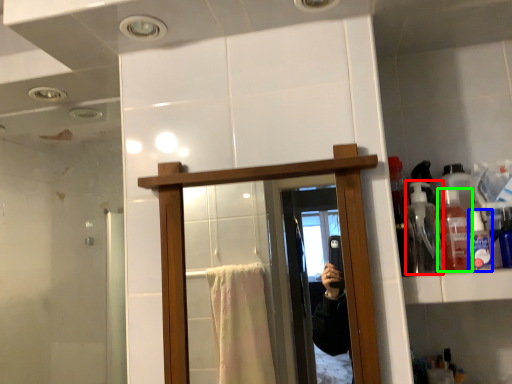
Question: Estimate the real-world distances between objects in this image. Which object is closer to bottle (highlighted by a red box), toiletry (highlighted by a blue box) or bottle (highlighted by a green box)?

Choices:
 (A) toiletry
 (B) bottle

Answer: (B)